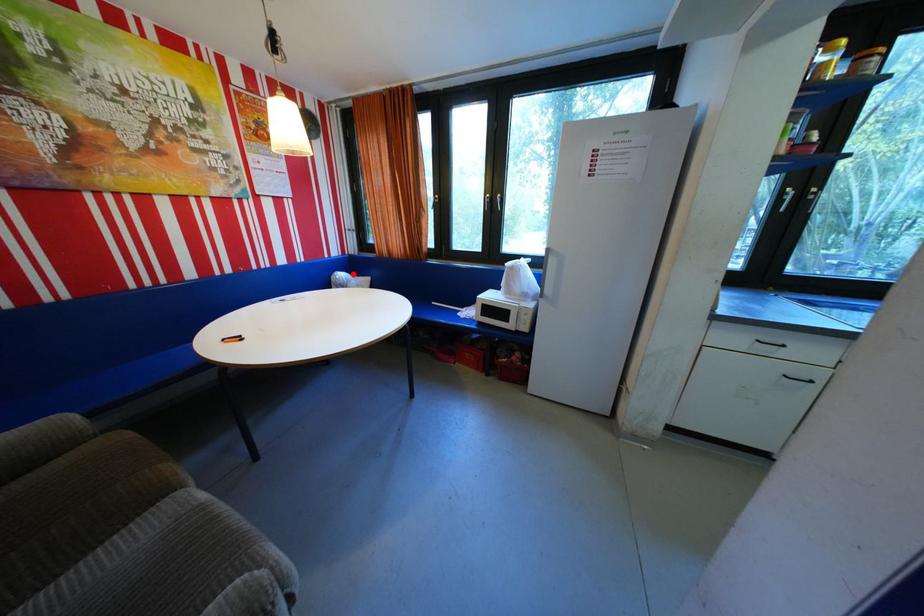
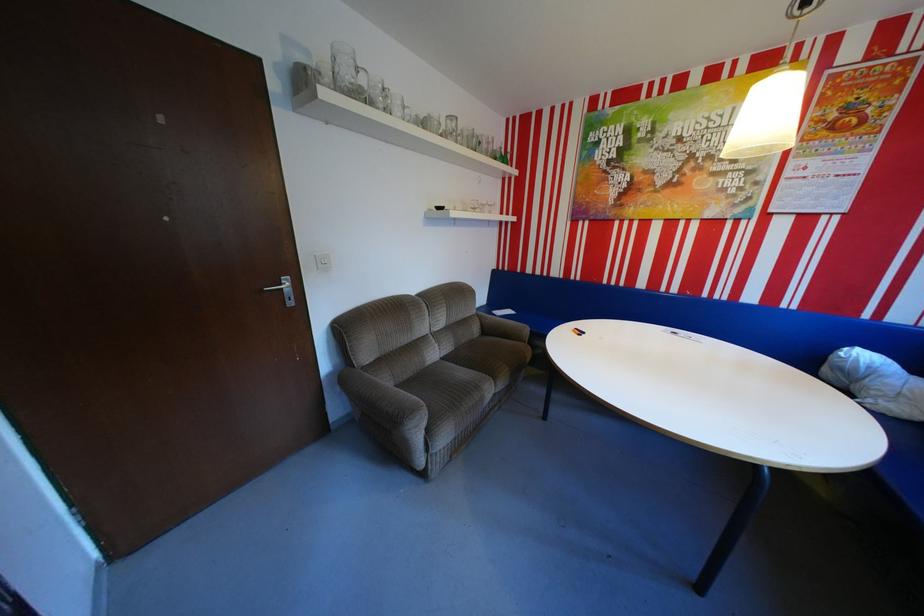
Find the pixel in the second image that matches the highlighted location in the first image.

(874, 355)